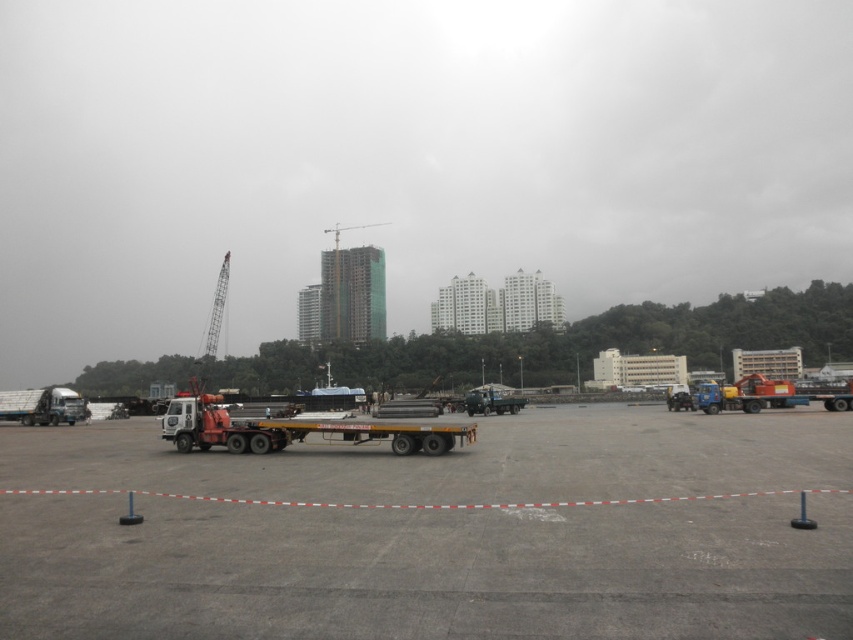
You are a delivery driver who needs to park your truck, which is 2 meters wide, in the construction site. You see the orange metallic tow truck at center and the green glassy building at center. Is there enough space between them to park your truck?

The orange metallic tow truck at center is narrower than the green glassy building at center, but the description only provides their widths relative to each other and does not specify the distance between them. Therefore, it is unclear if there is enough space to park your truck between them.

You are an engineer assessing the construction site. You see the orange metallic tow truck at center and the green glassy building at center. Which object is positioned lower in the image?

The orange metallic tow truck at center is located below the green glassy building at center, so it is positioned lower in the image.

You are a delivery driver who needs to park your truck on the gray concrete tarmac at center. However, you must avoid blocking the entrance to the green glassy building at center. Based on the scene, can you safely park there without blocking the entrance?

The gray concrete tarmac at center is positioned on the right side of the green glassy building at center, so parking there would not block the entrance as it is to the side rather than directly in front.